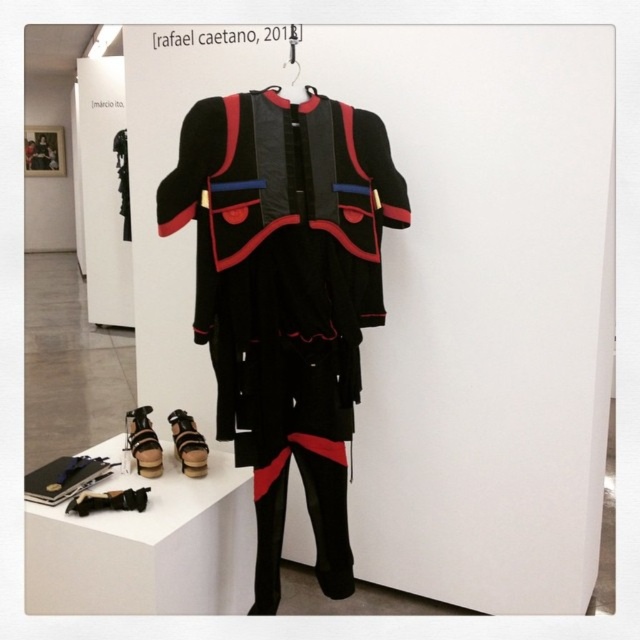
Question: Does matte black uniform at center come in front of black leather shoe at lower left?

Choices:
 (A) yes
 (B) no

Answer: (A)

Question: Does black smooth pants at lower center have a smaller size compared to metallic silver hanger at upper center?

Choices:
 (A) yes
 (B) no

Answer: (B)

Question: Which of these objects is positioned farthest from the matte black uniform at center?

Choices:
 (A) matte black sandal at lower left
 (B) leather sandal at lower center
 (C) black smooth pants at lower center
 (D) metallic silver hanger at upper center

Answer: (A)

Question: Among these points, which one is farthest from the camera?

Choices:
 (A) (125, 497)
 (B) (195, 424)
 (C) (292, 93)

Answer: (B)

Question: Is matte black uniform at center below black smooth pants at lower center?

Choices:
 (A) yes
 (B) no

Answer: (B)

Question: Which point is closer to the camera taking this photo?

Choices:
 (A) (156, 476)
 (B) (115, 496)

Answer: (B)